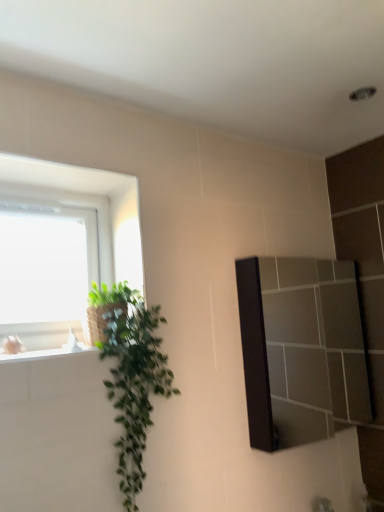
Question: Based on their positions, is green leafy plant at left located to the left or right of matte black mirror at right?

Choices:
 (A) right
 (B) left

Answer: (B)

Question: Relative to matte black mirror at right, is green leafy plant at left in front or behind?

Choices:
 (A) behind
 (B) front

Answer: (B)

Question: Considering the positions of green leafy plant at left and matte black mirror at right in the image, is green leafy plant at left wider or thinner than matte black mirror at right?

Choices:
 (A) thin
 (B) wide

Answer: (B)

Question: In the image, is matte black mirror at right on the left side or the right side of green leafy plant at left?

Choices:
 (A) right
 (B) left

Answer: (A)

Question: Considering the positions of matte black mirror at right and green leafy plant at left in the image, is matte black mirror at right bigger or smaller than green leafy plant at left?

Choices:
 (A) big
 (B) small

Answer: (B)

Question: Is point (337, 397) closer or farther from the camera than point (152, 308)?

Choices:
 (A) farther
 (B) closer

Answer: (A)

Question: From a real-world perspective, relative to green leafy plant at left, is matte black mirror at right vertically above or below?

Choices:
 (A) above
 (B) below

Answer: (A)